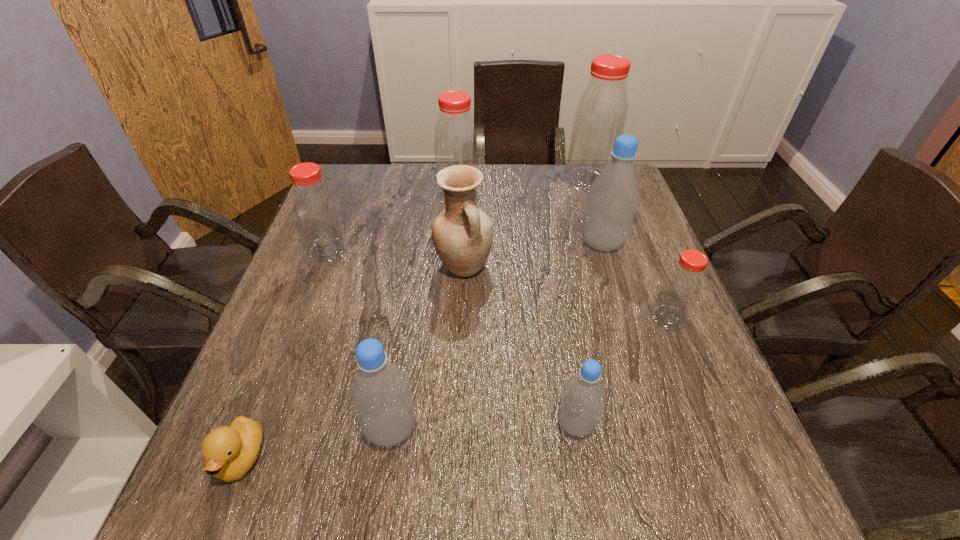
Locate an element on the screen. The width and height of the screenshot is (960, 540). free area in between the second smallest red bottle and the pottery is located at coordinates (396, 259).

Where is `vacant area that lies between the duckling and the second gray bottle from right to left`? Image resolution: width=960 pixels, height=540 pixels. vacant area that lies between the duckling and the second gray bottle from right to left is located at coordinates (409, 441).

Locate an element on the screen. The image size is (960, 540). vacant space that is in between the farthest gray bottle and the third smallest red bottle is located at coordinates (530, 219).

Where is `free point between the tallest object and the third nearest bottle`? The width and height of the screenshot is (960, 540). free point between the tallest object and the third nearest bottle is located at coordinates (629, 249).

This screenshot has width=960, height=540. I want to click on free space between the tallest object and the leftmost gray bottle, so click(x=490, y=304).

At what (x,y) coordinates should I click in order to perform the action: click on free space between the biggest gray bottle and the shortest object. Please return your answer as a coordinate pair (x, y). Image resolution: width=960 pixels, height=540 pixels. Looking at the image, I should click on (422, 350).

Where is `free spot between the leftmost bottle and the smallest gray bottle`? free spot between the leftmost bottle and the smallest gray bottle is located at coordinates (452, 337).

Locate which object is the eighth closest to the smallest gray bottle. Please provide its 2D coordinates. Your answer should be formatted as a tuple, i.e. [(x, y)], where the tuple contains the x and y coordinates of a point satisfying the conditions above.

[(601, 114)]

I want to click on the closest object to the leftmost gray bottle, so click(230, 452).

This screenshot has width=960, height=540. I want to click on bottle that stands as the fourth closest to the nearest red bottle, so click(381, 397).